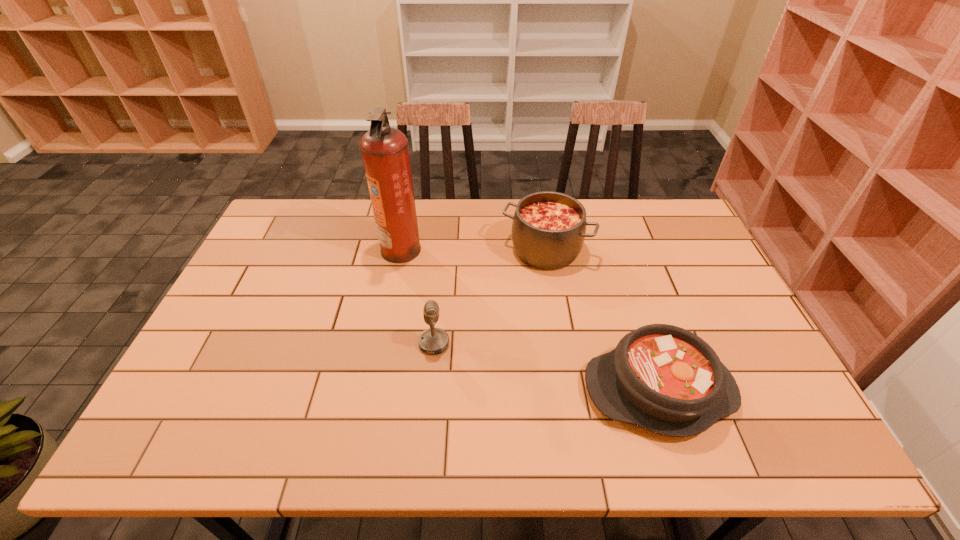
Locate an element on the screen. This screenshot has height=540, width=960. fire extinguisher is located at coordinates (385, 152).

The height and width of the screenshot is (540, 960). I want to click on the leftmost object, so click(385, 152).

Where is `the farther casserole`? Image resolution: width=960 pixels, height=540 pixels. the farther casserole is located at coordinates (548, 230).

The image size is (960, 540). What are the coordinates of `the second object from left to right` in the screenshot? It's located at (434, 340).

Locate an element on the screen. the shortest object is located at coordinates (663, 378).

Identify the location of the nearer casserole. (663, 378).

Locate an element on the screen. The image size is (960, 540). free location located at the nozzle of the leftmost object is located at coordinates (445, 249).

You are a GUI agent. You are given a task and a screenshot of the screen. Output one action in this format:
    pyautogui.click(x=<x>, y=<y>)
    Task: Click on the vacant area situated on the left of the farther casserole
    
    Given the screenshot: What is the action you would take?
    pyautogui.click(x=465, y=249)

At what (x,y) coordinates should I click in order to perform the action: click on vacant space situated on the front-facing side of the second object from left to right. Please return your answer as a coordinate pair (x, y). Image resolution: width=960 pixels, height=540 pixels. Looking at the image, I should click on (593, 343).

Where is `blank space located 0.050m on the right of the shortest object`? The width and height of the screenshot is (960, 540). blank space located 0.050m on the right of the shortest object is located at coordinates (754, 390).